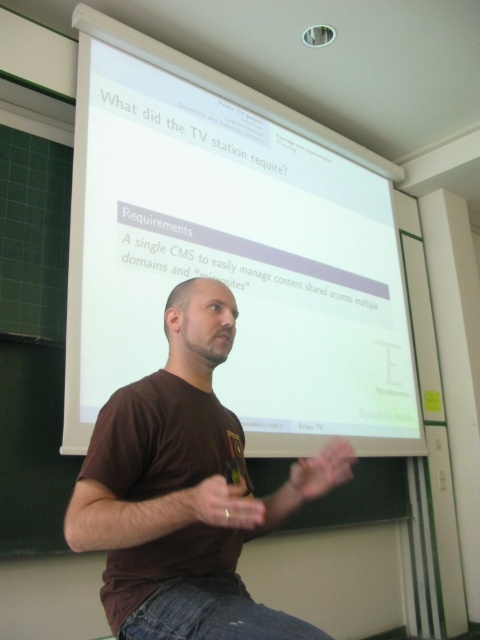
You are a photographer positioned at the camera. You need to capture a closeup shot of the point at coordinates [104,333]. Given that your current distance is 2.43 meters away from the point, is this distance sufficient to ensure the subject fills the frame without being too cropped?

The point at coordinates [104,333] is 2.43 meters away from the camera. This distance may be sufficient for a closeup, but it depends on the lens focal length and sensor size of the camera being used. Without specific equipment details, it is difficult to determine if the subject will fill the frame appropriately without cropping.

Based on the photo, you are a presenter standing in front of the projection screen. You notice a point marked at coordinate (222, 504). Where is this point located relative to your body?

The point at coordinate (222, 504) is on the matte brown hand at center, so it is located on your hand in the center of your body.

You are a fashion designer observing a presentation. You notice the man wearing a brown cotton shirt at center and a matte brown hand at center. Which item is wider when viewed from the front?

The brown cotton shirt at center might be wider than matte brown hand at center.